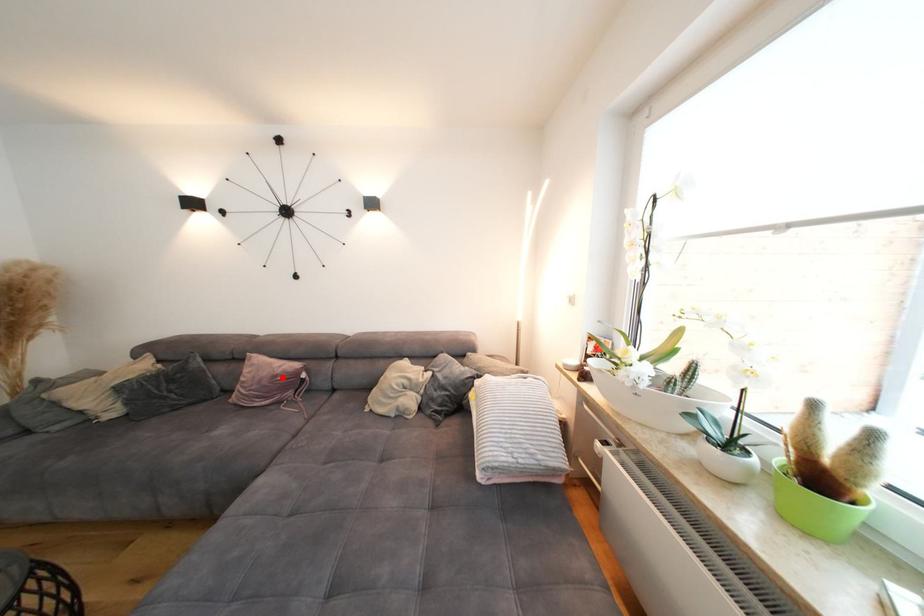
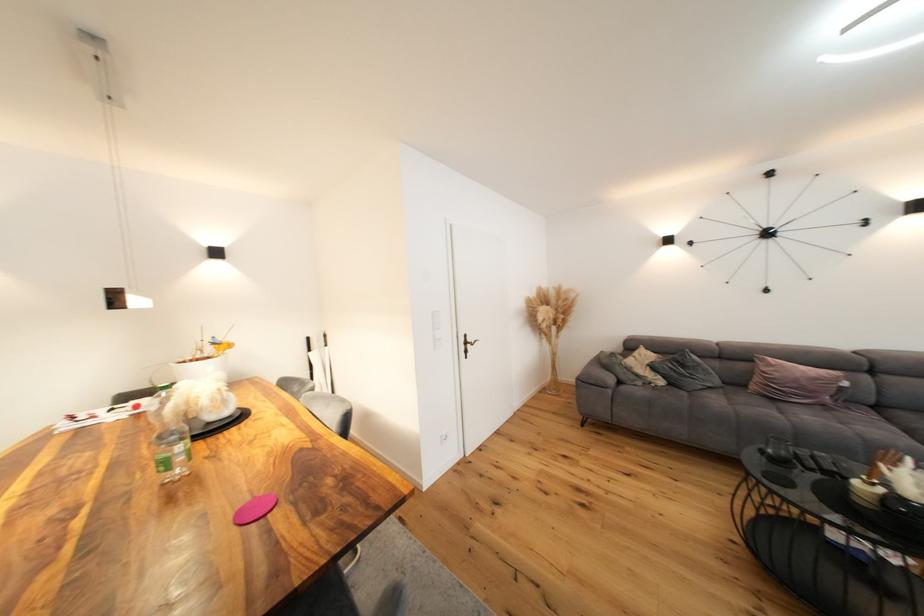
Question: I am providing you with two images of the same scene from different viewpoints. A red point is shown in image1. For the corresponding object point in image2, is it positioned nearer or farther from the camera?

Choices:
 (A) Nearer
 (B) Farther

Answer: (A)